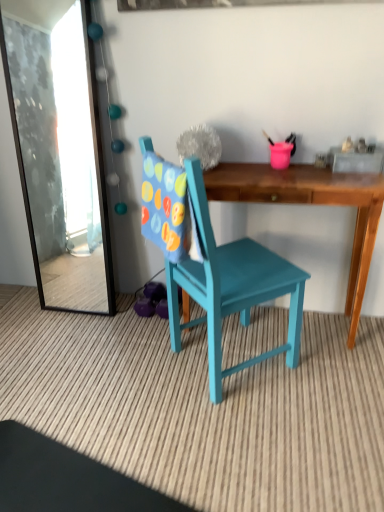
At what (x,y) coordinates should I click in order to perform the action: click on vacant area located to the right-hand side of teal painted wood chair at center. Please return your answer as a coordinate pair (x, y). This screenshot has width=384, height=512. Looking at the image, I should click on (337, 380).